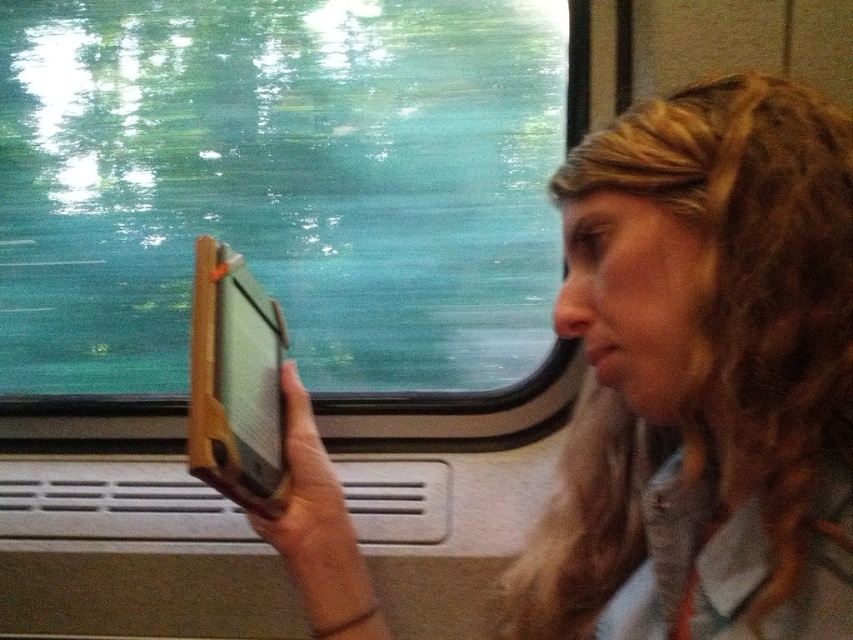
You are designing a case for both the matte black tablet at center and the wooden tablet at center. Since both are at the center, how should you adjust the case sizes to accommodate their height difference?

The matte black tablet at center is taller than the wooden tablet at center, so the case for the matte black tablet at center should be larger in height to accommodate its size while the wooden tablet at center requires a slightly shorter case.